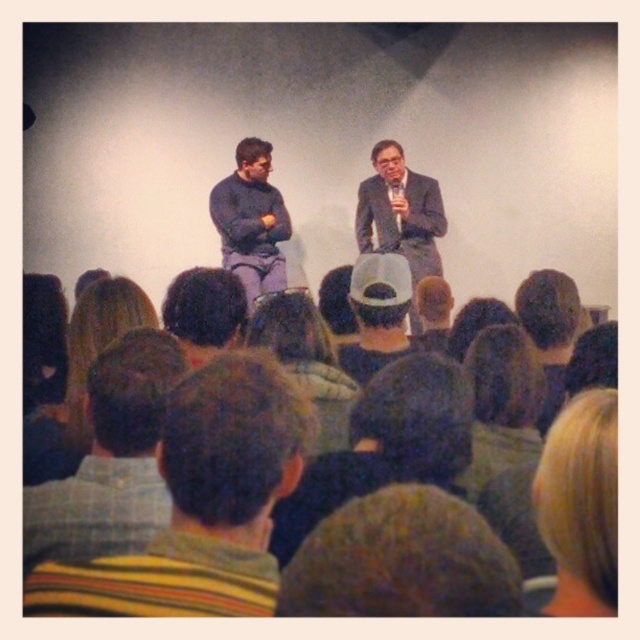
You are an event organizer who needs to arrange seating for the speakers. The speaker wearing the striped sweater at center is scheduled to speak next. Where should you place their chair relative to the striped shirt at lower left?

The striped sweater at center is to the right of the striped shirt at lower left, so you should place their chair to the right of the striped shirt at lower left.

Consider the image. You are a photographer positioned at the back of the room. You need to capture a photo where both the matte blue sweater at center and the matte black suit at center are clearly visible. Given their heights, which person should you adjust your camera angle to focus on first to ensure both are in frame?

The matte blue sweater at center is shorter than the matte black suit at center. To ensure both are in frame, you should first focus on the taller matte black suit at center and adjust the camera angle to include the shorter matte blue sweater at center as well.

You are an event organizer and need to place a name tag on the stage. The name tag must be placed exactly at the coordinates where the matte blue sweater at center is located. What are the coordinates where you should place the name tag?

The coordinates for the matte blue sweater at center are at point (252, 220), so you should place the name tag there.